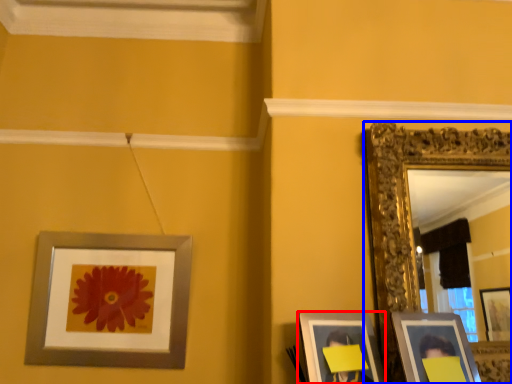
Question: Which point is closer to the camera, picture frame (highlighted by a red box) or picture frame (highlighted by a blue box)?

Choices:
 (A) picture frame
 (B) picture frame

Answer: (A)